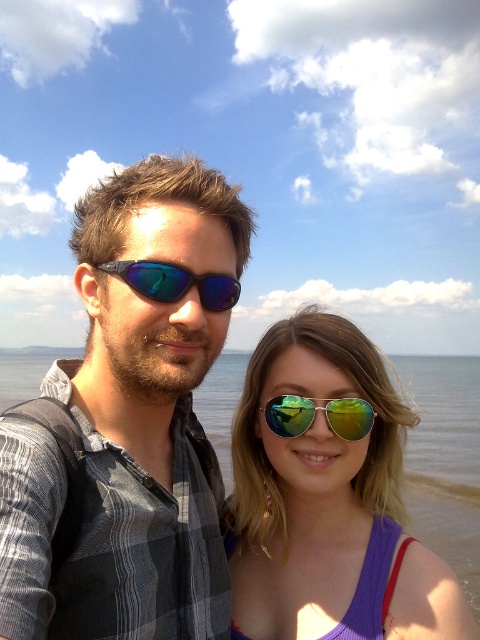
Between matte black sunglasses at center and clear water at center, which one appears on the left side from the viewer's perspective?

Positioned to the left is matte black sunglasses at center.

Can you confirm if matte black sunglasses at center is positioned to the left of clear water at center?

Indeed, matte black sunglasses at center is positioned on the left side of clear water at center.

Which is behind, point (237, 218) or point (429, 467)?

Positioned behind is point (429, 467).

Where is `matte black sunglasses at center`? This screenshot has width=480, height=640. matte black sunglasses at center is located at coordinates (128, 422).

Can you confirm if matte black sunglasses at center is positioned below shiny reflective sunglasses at center?

Incorrect, matte black sunglasses at center is not positioned below shiny reflective sunglasses at center.

Is point (126, 294) closer to viewer compared to point (348, 554)?

That is True.

Image resolution: width=480 pixels, height=640 pixels. Identify the location of matte black sunglasses at center. (128, 422).

You are a GUI agent. You are given a task and a screenshot of the screen. Output one action in this format:
    pyautogui.click(x=<x>, y=<y>)
    Task: Click on the matte black sunglasses at center
    This screenshot has width=480, height=640.
    Given the screenshot: What is the action you would take?
    pyautogui.click(x=128, y=422)

Can you confirm if shiny reflective sunglasses at center is smaller than reflective gold sunglasses at center?

Incorrect, shiny reflective sunglasses at center is not smaller in size than reflective gold sunglasses at center.

Which is behind, point (236, 604) or point (300, 404)?

Point (236, 604)

Identify the location of shiny reflective sunglasses at center. (325, 496).

Where is `shiny reflective sunglasses at center`? shiny reflective sunglasses at center is located at coordinates (325, 496).